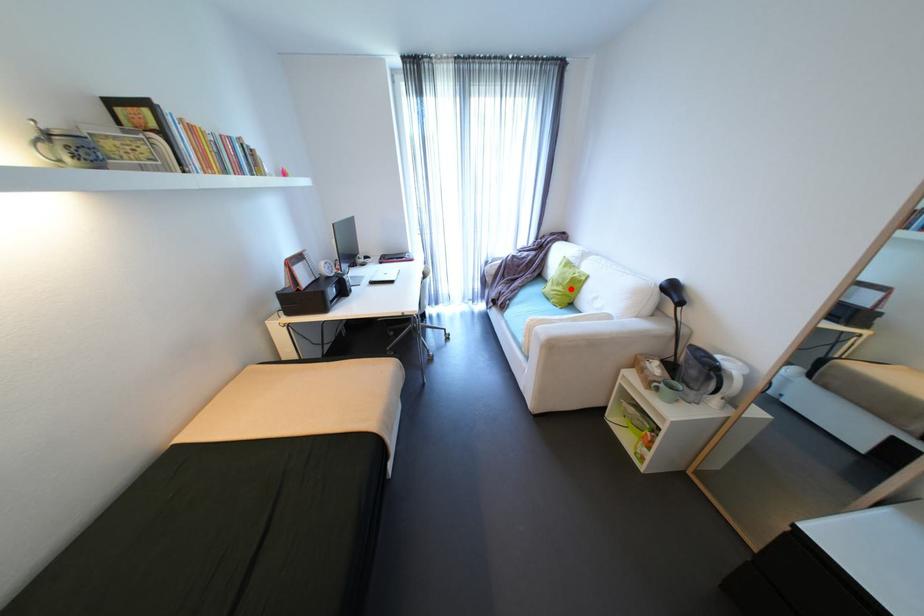
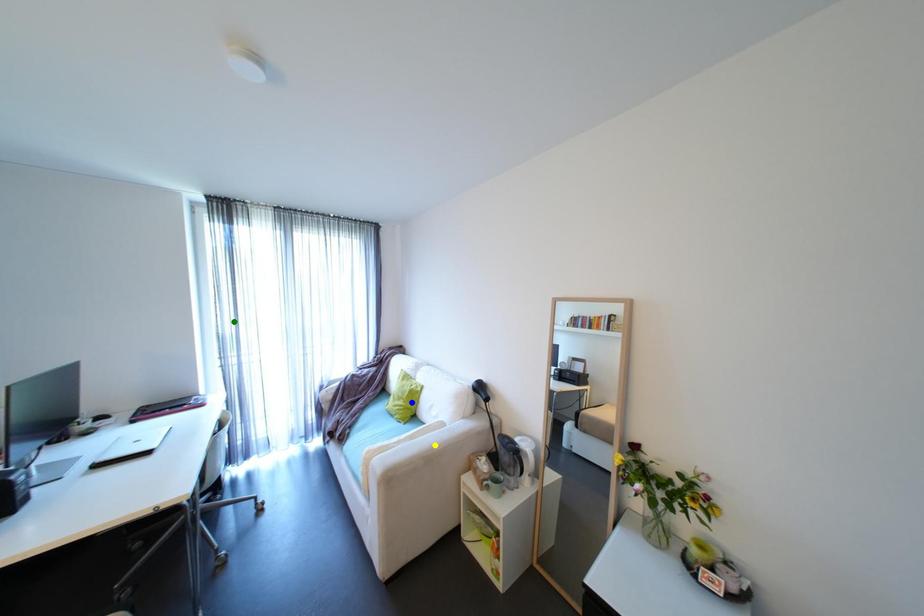
Question: I am providing you with two images of the same scene from different viewpoints. A red point is marked on the first image. You are given multiple points on the second image. Which point in image 2 is actually the same real-world point as the red point in image 1?

Choices:
 (A) blue point
 (B) green point
 (C) yellow point

Answer: (A)